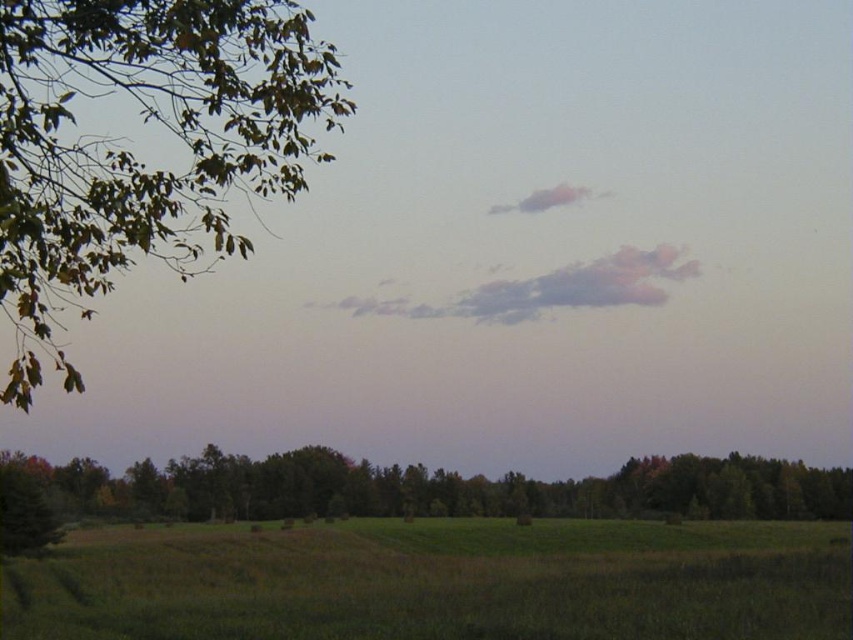
You are standing in the middle of the green grassy field at lower center and want to reach the green leafy tree at lower center. Which direction should you walk to get closer to the tree?

The green leafy tree at lower center is below the green grassy field at lower center, so you should walk downward to get closer to the tree.

You are standing in the middle of the green grassy field at lower center and want to walk towards the green leafy tree at lower center. Which direction should you head?

The green grassy field at lower center is on the right side of the green leafy tree at lower center, so you should head to the left to reach the tree.

You are standing in the rural landscape and want to take a photo of the green leafy tree at lower center and the pink cotton cloud at upper center. Which object is positioned higher in the frame?

The pink cotton cloud at upper center is positioned higher in the frame than the green leafy tree at lower center.